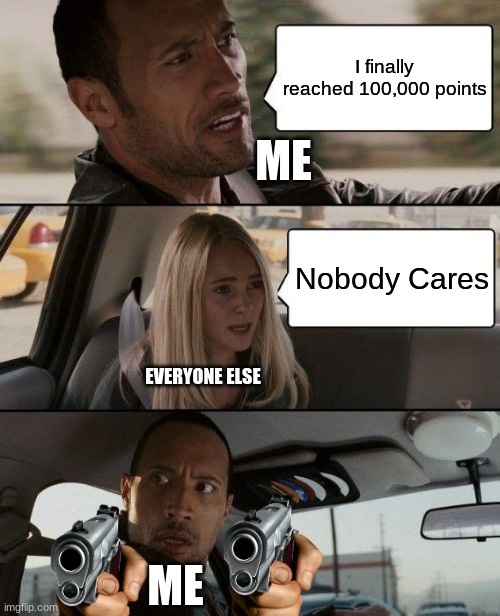
Identify the location of windows. The width and height of the screenshot is (500, 616). (402, 559), (78, 506), (24, 318).